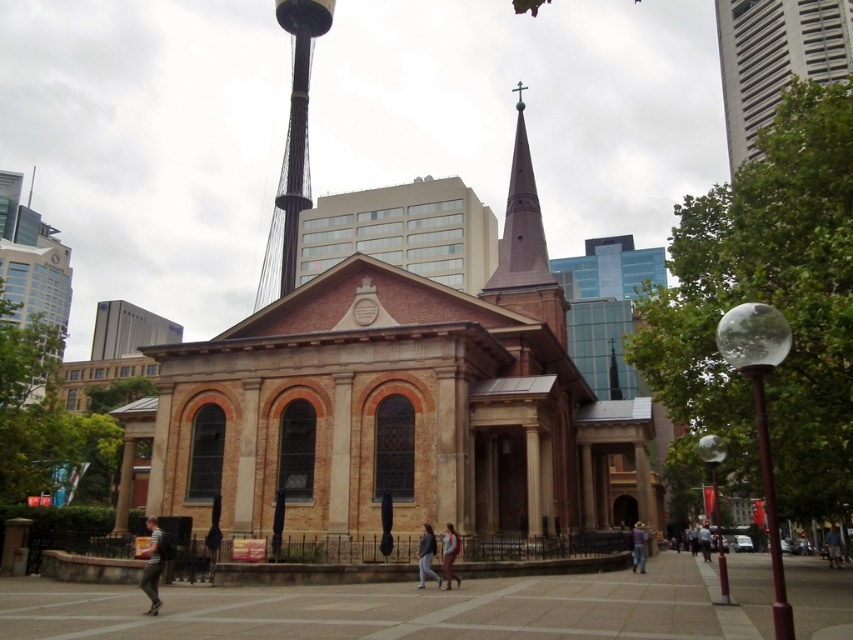
You are a pedestrian standing at the entrance of the church. You see a clear glass pole at lower right and blue denim jeans at lower right. Which object is larger in size?

The clear glass pole at lower right is bigger than the blue denim jeans at lower right, so the clear glass pole is larger in size.

You are a visitor standing in front of the historic church. You see a clear glass pole at lower right and blue denim jeans at lower right. Which object is closer to the left side of the scene?

The clear glass pole at lower right is positioned on the left side of blue denim jeans at lower right, so it is closer to the left side of the scene.

You are standing in front of the historic church and want to take a photo that includes both the white glass tower at upper right and the blue denim jeans at lower right. Which object will appear taller in the photo?

The white glass tower at upper right will appear taller in the photo because it has a greater height compared to the blue denim jeans at lower right.